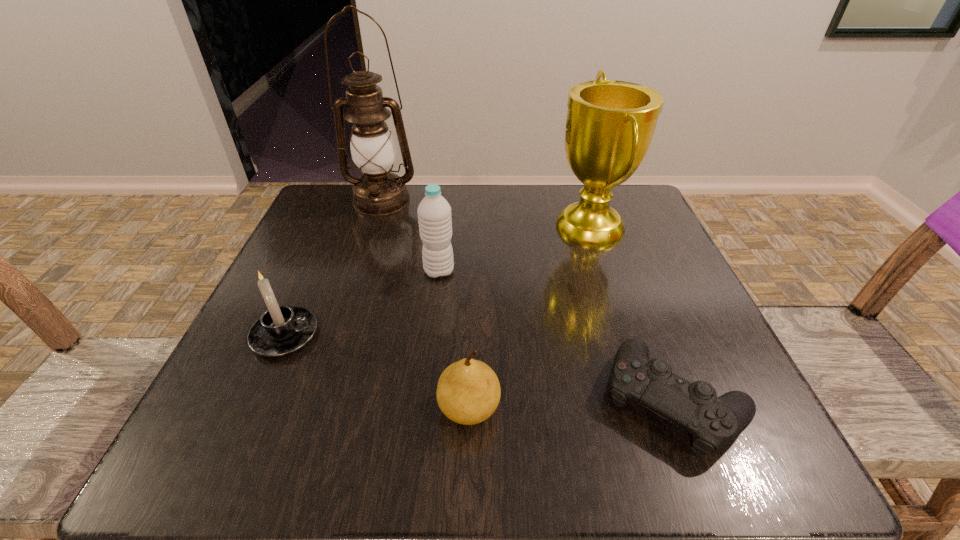
You are a GUI agent. You are given a task and a screenshot of the screen. Output one action in this format:
    pyautogui.click(x=<x>, y=<y>)
    Task: Click on the vacant space located 0.210m on the right of the water bottle
    This screenshot has height=540, width=960.
    Given the screenshot: What is the action you would take?
    pyautogui.click(x=562, y=271)

Locate an element on the screen. vacant position located 0.080m with a handle on the side of the candle holder is located at coordinates (366, 336).

Locate an element on the screen. The image size is (960, 540). vacant space located on the right of the pear is located at coordinates (737, 408).

Locate an element on the screen. This screenshot has width=960, height=540. vacant space located on the left of the control is located at coordinates (468, 400).

I want to click on oil lamp that is at the far edge, so click(x=379, y=192).

Find the location of a particular element. This screenshot has width=960, height=540. award at the far edge is located at coordinates (610, 124).

Locate an element on the screen. Image resolution: width=960 pixels, height=540 pixels. pear at the near edge is located at coordinates (468, 392).

At what (x,y) coordinates should I click in order to perform the action: click on control at the near edge. Please return your answer as a coordinate pair (x, y). Looking at the image, I should click on (714, 422).

Locate an element on the screen. The width and height of the screenshot is (960, 540). oil lamp located at the left edge is located at coordinates (379, 192).

Find the location of a particular element. candle holder that is at the left edge is located at coordinates (282, 330).